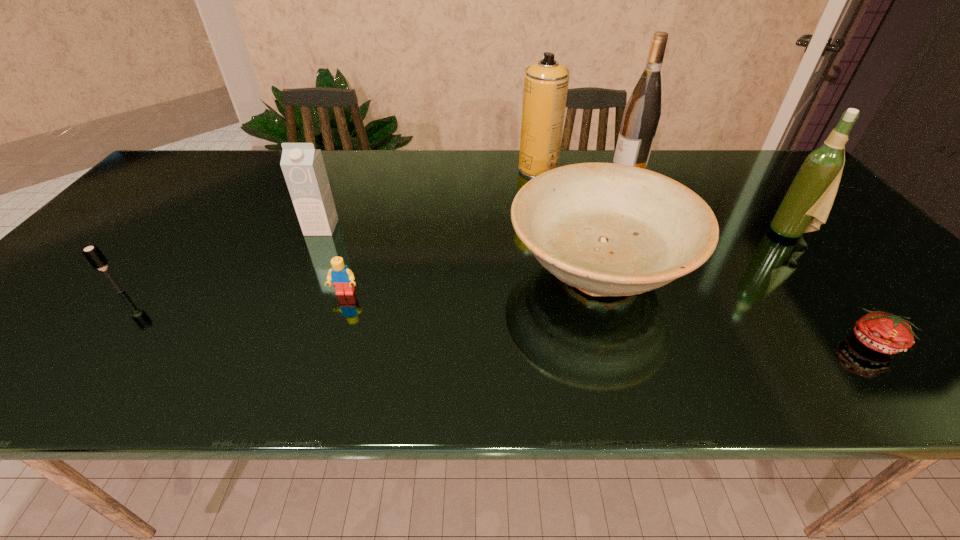
Where is `empty location between the leftmost object and the fifth tallest object`? empty location between the leftmost object and the fifth tallest object is located at coordinates (359, 281).

Where is `blank region between the third shortest object and the shortest object`? blank region between the third shortest object and the shortest object is located at coordinates pos(498,317).

Locate an element on the screen. the second closest object to the left wine bottle is located at coordinates (608, 229).

Locate an element on the screen. the second closest object to the leftmost object is located at coordinates (342, 278).

The width and height of the screenshot is (960, 540). Identify the location of free space that satisfies the following two spatial constraints: 1. on the front side of the aerosol can; 2. on the left side of the tomato. tap(571, 343).

Where is `vacant region that satisfies the following two spatial constraints: 1. on the back side of the aerosol can; 2. on the right side of the taller wine bottle`? vacant region that satisfies the following two spatial constraints: 1. on the back side of the aerosol can; 2. on the right side of the taller wine bottle is located at coordinates (538, 168).

Locate an element on the screen. The width and height of the screenshot is (960, 540). vacant point that satisfies the following two spatial constraints: 1. on the front-facing side of the tomato; 2. on the right side of the second shortest object is located at coordinates (329, 343).